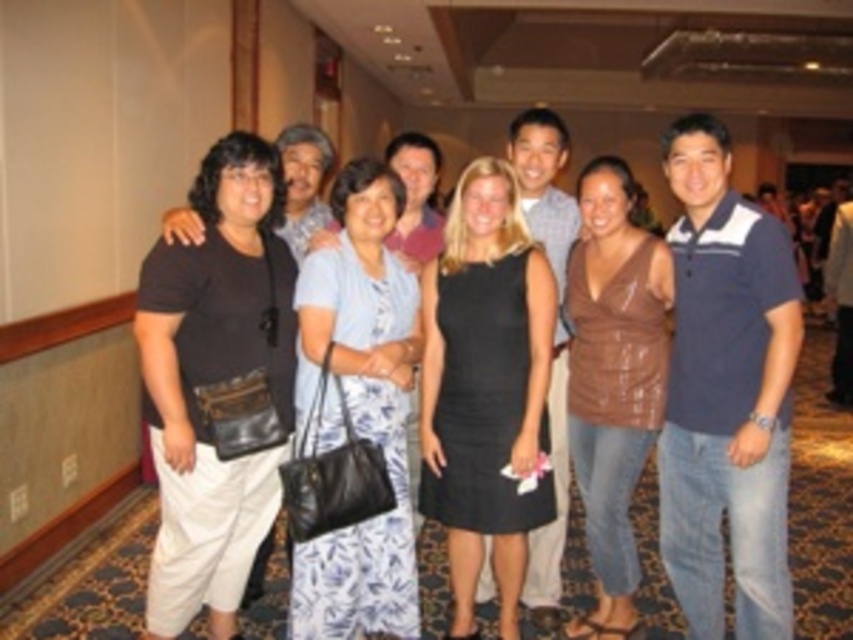
Question: Among these objects, which one is farthest from the camera?

Choices:
 (A) brown leather top at center
 (B) black satin dress at center

Answer: (A)

Question: Which point is farther from the camera taking this photo?

Choices:
 (A) (466, 173)
 (B) (666, 273)
 (C) (374, 560)

Answer: (A)

Question: Is black satin dress at center closer to camera compared to brown leather top at center?

Choices:
 (A) yes
 (B) no

Answer: (A)

Question: Is light blue floral dress at center below brown leather top at center?

Choices:
 (A) no
 (B) yes

Answer: (A)

Question: Which of these objects is positioned closest to the brown leather top at center?

Choices:
 (A) light blue floral dress at center
 (B) black satin dress at center

Answer: (B)

Question: In this image, where is black satin dress at center located relative to brown leather top at center?

Choices:
 (A) below
 (B) above

Answer: (A)